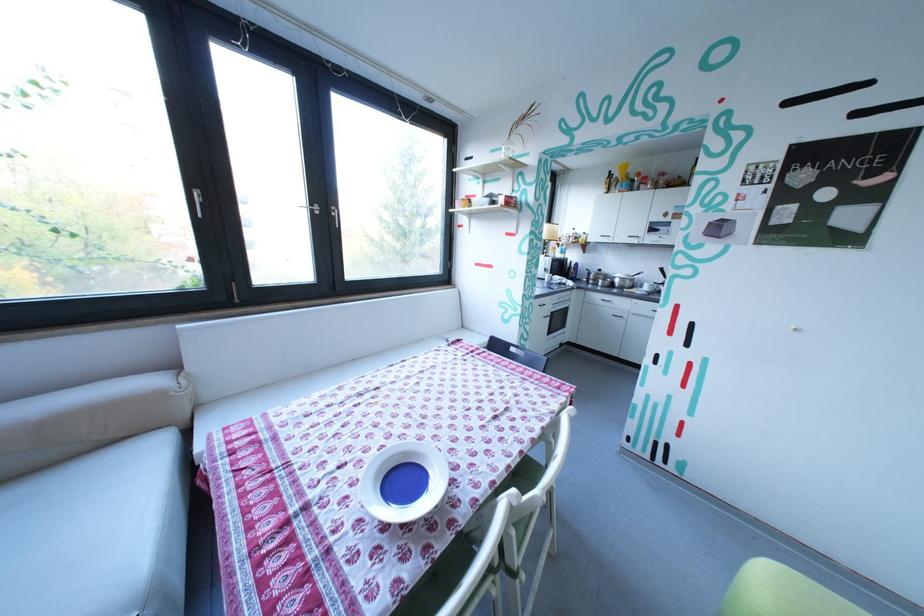
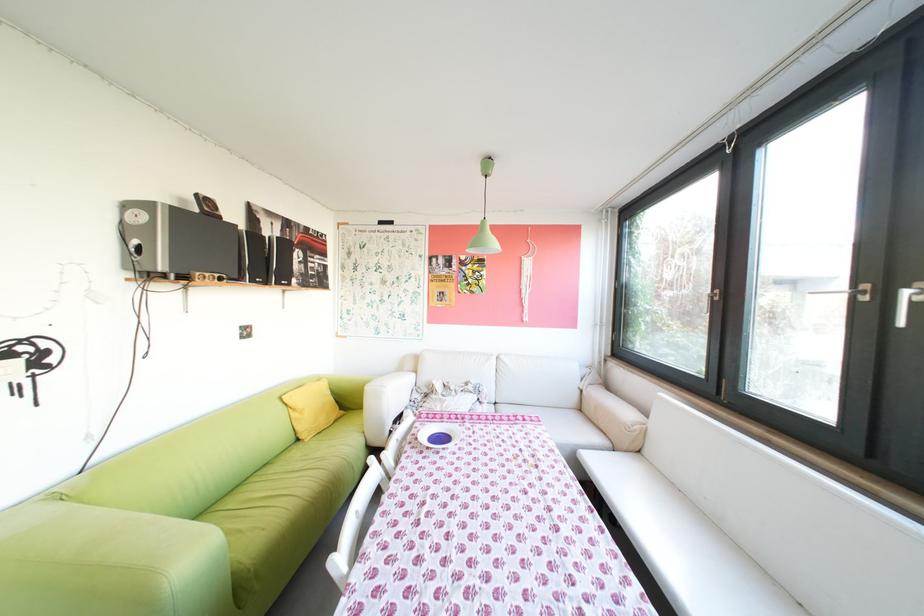
The point at (323, 205) is marked in the first image. Where is the corresponding point in the second image?

(867, 285)